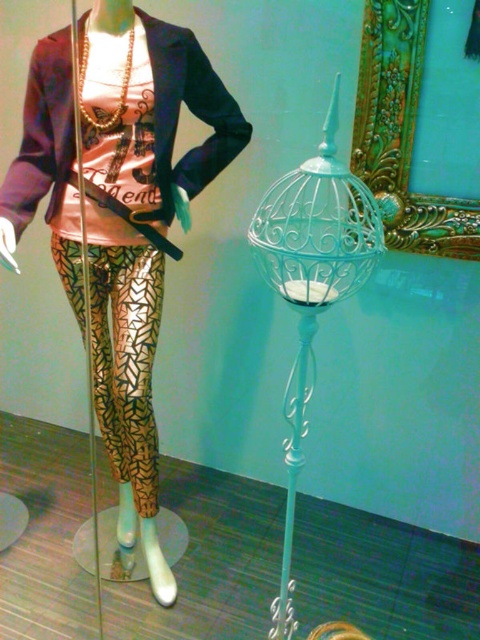
Question: Does metallic gold pants at center have a smaller size compared to white wrought iron lamp at right?

Choices:
 (A) yes
 (B) no

Answer: (B)

Question: Where is metallic gold pants at center located in relation to white wrought iron lamp at right in the image?

Choices:
 (A) left
 (B) right

Answer: (A)

Question: Among these objects, which one is farthest from the camera?

Choices:
 (A) white wrought iron lamp at right
 (B) metallic gold pants at center

Answer: (B)

Question: Does metallic gold pants at center lie behind white wrought iron lamp at right?

Choices:
 (A) no
 (B) yes

Answer: (B)